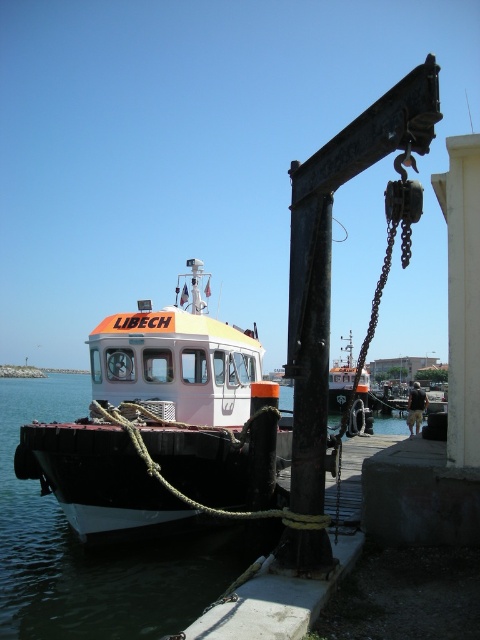
Question: Does black rubber water at lower left appear under orange matte boat at center?

Choices:
 (A) yes
 (B) no

Answer: (A)

Question: Which object appears farthest from the camera in this image?

Choices:
 (A) black rubber water at lower left
 (B) white matte boat at center

Answer: (B)

Question: Does black rubber water at lower left have a smaller size compared to orange matte boat at center?

Choices:
 (A) yes
 (B) no

Answer: (B)

Question: Considering the real-world distances, which object is farthest from the white matte boat at center?

Choices:
 (A) black rubber water at lower left
 (B) orange matte boat at center

Answer: (B)

Question: Can you confirm if white matte boat at center is wider than orange matte boat at center?

Choices:
 (A) no
 (B) yes

Answer: (A)

Question: Which point is closer to the camera taking this photo?

Choices:
 (A) (367, 397)
 (B) (28, 586)

Answer: (B)